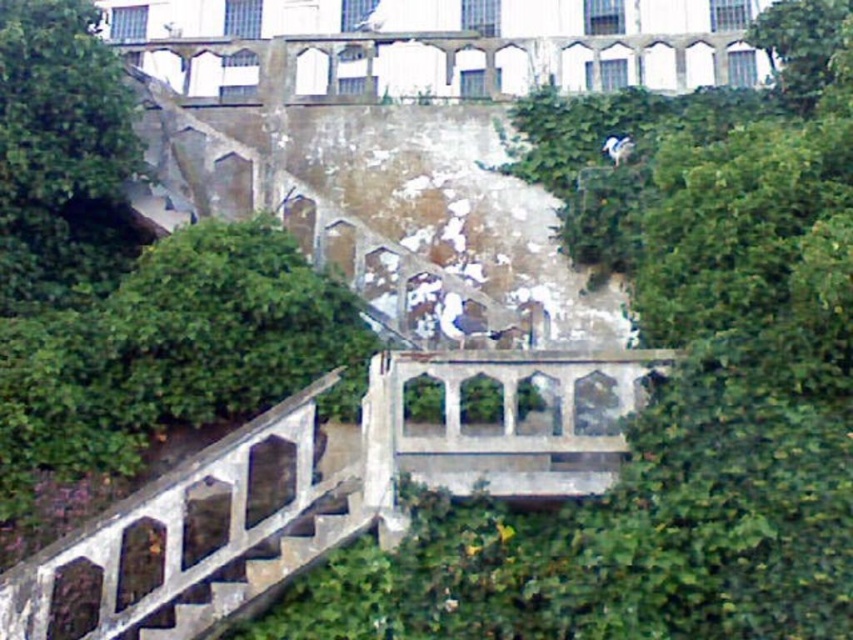
You are planning to take a photo of the stone structures in the scene. You want to ensure both the green leafy tree at upper left and the green leafy tree at upper right are visible in the frame. Based on their widths, which tree might require you to adjust your camera angle more to include its entire width?

The green leafy tree at upper left might require adjusting the camera angle more because it might be wider than the green leafy tree at upper right according to the description.

You are standing at the base of the staircase and want to take a photo of both the green leafy tree at left and the green leafy tree at upper right. Which tree should you position yourself closer to in order to capture both in the same frame?

You should position yourself closer to the green leafy tree at left because it is shorter than the green leafy tree at upper right, allowing both to fit within the camera frame more easily.